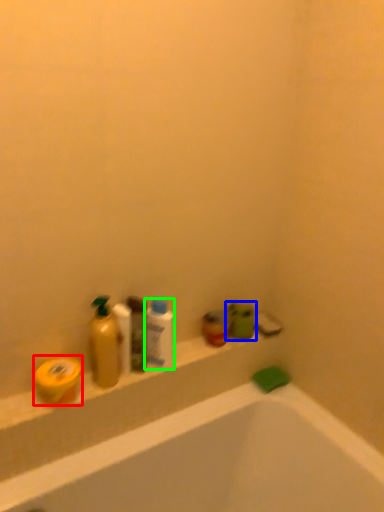
Question: Which is farther away from soap (highlighted by a red box)? toiletry (highlighted by a blue box) or mouthwash (highlighted by a green box)?

Choices:
 (A) toiletry
 (B) mouthwash

Answer: (A)